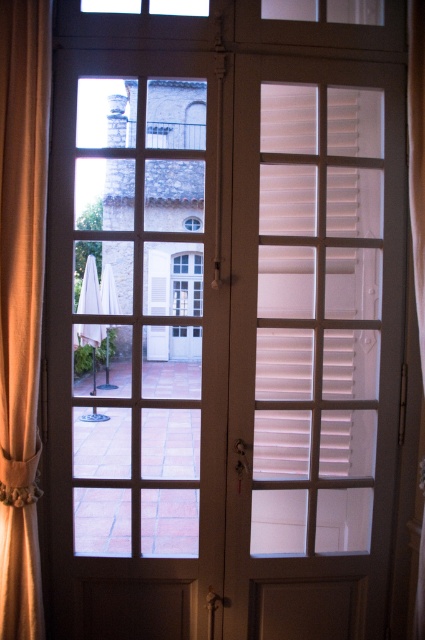
Question: Is transparent glass window at upper center to the right of transparent glass window at center from the viewer's perspective?

Choices:
 (A) no
 (B) yes

Answer: (B)

Question: Which object appears farthest from the camera in this image?

Choices:
 (A) transparent glass window at upper center
 (B) beige fabric curtain at left

Answer: (A)

Question: Observing the image, what is the correct spatial positioning of beige fabric curtain at right in reference to transparent glass window at upper center?

Choices:
 (A) above
 (B) below

Answer: (B)

Question: Does beige fabric curtain at right appear over transparent glass window at center?

Choices:
 (A) no
 (B) yes

Answer: (A)

Question: Estimate the real-world distances between objects in this image. Which object is farther from the transparent glass window at upper center?

Choices:
 (A) beige fabric curtain at right
 (B) beige fabric curtain at left
 (C) transparent glass window at center

Answer: (B)

Question: Which point is farther to the camera?

Choices:
 (A) (421, 106)
 (B) (121, 6)
 (C) (34, 449)

Answer: (B)